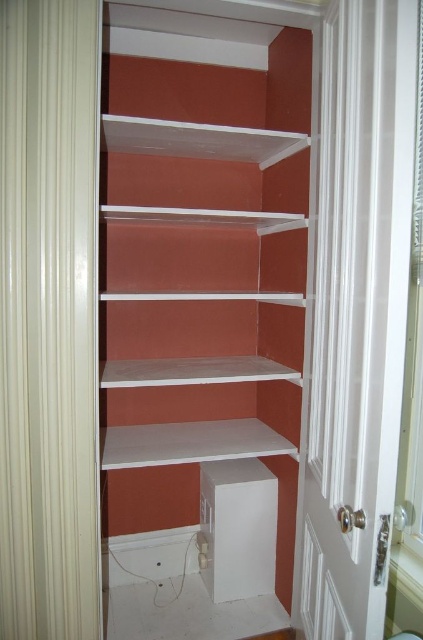
Question: Which object is farther from the camera taking this photo?

Choices:
 (A) white matte shelves at center
 (B) beige textured curtain at left
 (C) white glossy door at center

Answer: (A)

Question: Does beige textured curtain at left come in front of white glossy door at center?

Choices:
 (A) yes
 (B) no

Answer: (B)

Question: Can you confirm if white matte shelves at center is positioned above white glossy door at center?

Choices:
 (A) yes
 (B) no

Answer: (A)

Question: Which point is closer to the camera?

Choices:
 (A) beige textured curtain at left
 (B) white glossy door at center

Answer: (B)

Question: Which is farther from the beige textured curtain at left?

Choices:
 (A) white glossy door at center
 (B) white matte shelves at center

Answer: (A)

Question: Considering the relative positions of beige textured curtain at left and white glossy door at center in the image provided, where is beige textured curtain at left located with respect to white glossy door at center?

Choices:
 (A) left
 (B) right

Answer: (A)